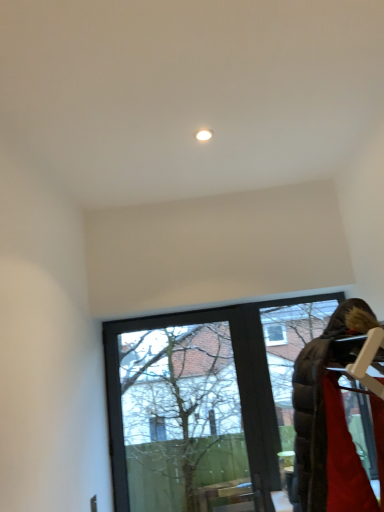
The width and height of the screenshot is (384, 512). Describe the element at coordinates (197, 405) in the screenshot. I see `transparent glass window at center` at that location.

Locate an element on the screen. This screenshot has width=384, height=512. transparent glass window at center is located at coordinates point(197,405).

Describe the element at coordinates (332, 421) in the screenshot. I see `velvet brown coat at lower right` at that location.

What is the approximate height of velvet brown coat at lower right?

It is 13.11 inches.

Locate an element on the screen. velvet brown coat at lower right is located at coordinates (332, 421).

Locate an element on the screen. transparent glass window at center is located at coordinates (197, 405).

Is velvet brown coat at lower right to the right of transparent glass window at center from the viewer's perspective?

Indeed, velvet brown coat at lower right is positioned on the right side of transparent glass window at center.

Which object is closer to the camera, velvet brown coat at lower right or transparent glass window at center?

velvet brown coat at lower right.

Which is behind, point (316, 399) or point (119, 351)?

The point (119, 351) is more distant.

From the image's perspective, is velvet brown coat at lower right above transparent glass window at center?

Yes, from the image's perspective, velvet brown coat at lower right is on top of transparent glass window at center.

From a real-world perspective, who is located lower, velvet brown coat at lower right or transparent glass window at center?

transparent glass window at center is physically lower.

Is velvet brown coat at lower right thinner than transparent glass window at center?

Incorrect, the width of velvet brown coat at lower right is not less than that of transparent glass window at center.

Between velvet brown coat at lower right and transparent glass window at center, which one has less height?

velvet brown coat at lower right.

Can you confirm if velvet brown coat at lower right is bigger than transparent glass window at center?

No, velvet brown coat at lower right is not bigger than transparent glass window at center.

Choose the correct answer: Is velvet brown coat at lower right inside transparent glass window at center or outside it?

velvet brown coat at lower right is located beyond the bounds of transparent glass window at center.

Is velvet brown coat at lower right positioned far away from transparent glass window at center?

Indeed, velvet brown coat at lower right is not near transparent glass window at center.

Does velvet brown coat at lower right turn towards transparent glass window at center?

No, velvet brown coat at lower right is not aimed at transparent glass window at center.

How different are the orientations of velvet brown coat at lower right and transparent glass window at center in degrees?

velvet brown coat at lower right and transparent glass window at center are facing 91.3 degrees away from each other.

Identify the location of woman that is above the transparent glass window at center (from a real-world perspective). This screenshot has height=512, width=384. (332, 421).

Considering the positions of objects transparent glass window at center and velvet brown coat at lower right in the image provided, who is more to the right, transparent glass window at center or velvet brown coat at lower right?

velvet brown coat at lower right is more to the right.

Is the position of transparent glass window at center more distant than that of velvet brown coat at lower right?

Yes, transparent glass window at center is further from the camera.

Is point (263, 476) in front of point (317, 450)?

No, (263, 476) is further to viewer.

From the image's perspective, which one is positioned lower, transparent glass window at center or velvet brown coat at lower right?

transparent glass window at center, from the image's perspective.

From a real-world perspective, which is physically below, transparent glass window at center or velvet brown coat at lower right?

transparent glass window at center, from a real-world perspective.

Can you confirm if transparent glass window at center is wider than velvet brown coat at lower right?

In fact, transparent glass window at center might be narrower than velvet brown coat at lower right.

Considering the relative sizes of transparent glass window at center and velvet brown coat at lower right in the image provided, is transparent glass window at center shorter than velvet brown coat at lower right?

No, transparent glass window at center is not shorter than velvet brown coat at lower right.

Does transparent glass window at center have a larger size compared to velvet brown coat at lower right?

A: Correct, transparent glass window at center is larger in size than velvet brown coat at lower right.

Is transparent glass window at center situated inside velvet brown coat at lower right or outside?

transparent glass window at center is outside velvet brown coat at lower right.

Is transparent glass window at center in contact with velvet brown coat at lower right?

transparent glass window at center and velvet brown coat at lower right are not in contact.

Is transparent glass window at center oriented towards velvet brown coat at lower right?

Yes, transparent glass window at center is turned towards velvet brown coat at lower right.

In order to click on woman in front of the transparent glass window at center in this screenshot , I will do `click(332, 421)`.

Locate an element on the screen. This screenshot has height=512, width=384. woman in front of the transparent glass window at center is located at coordinates (332, 421).

Where is `window on the left side of velvet brown coat at lower right`? window on the left side of velvet brown coat at lower right is located at coordinates (197, 405).